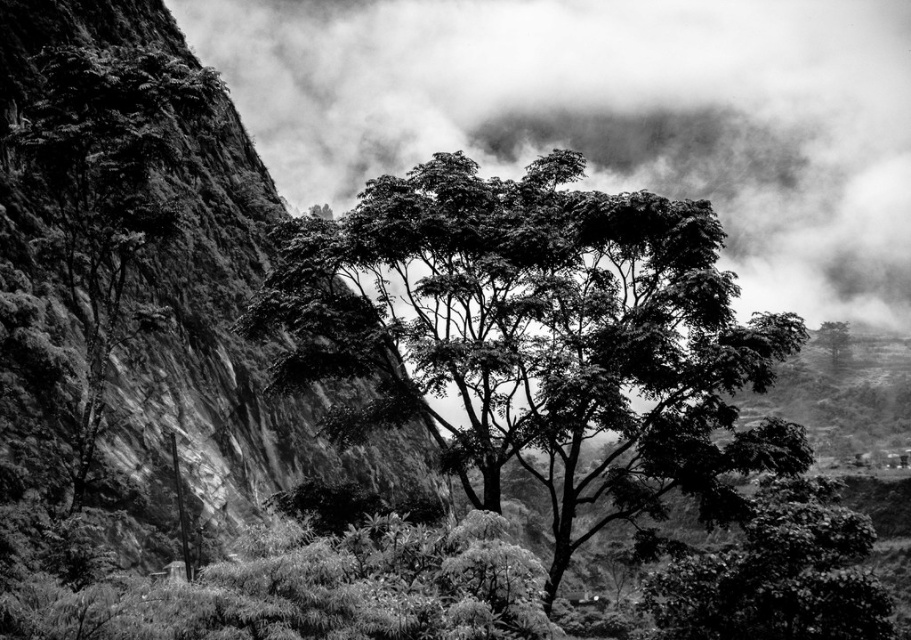
Locate an element on the screen. cloudy sky at upper center is located at coordinates (608, 115).

Consider the image. Is cloudy sky at upper center shorter than dark green leafy tree at left?

In fact, cloudy sky at upper center may be taller than dark green leafy tree at left.

Which is in front, point (275, 52) or point (132, 83)?

Point (132, 83)

Find the location of a particular element. This screenshot has width=911, height=640. cloudy sky at upper center is located at coordinates (608, 115).

Does dark green leafy tree at left have a larger size compared to green leafy tree at upper right?

Yes.

In the scene shown: Does dark green leafy tree at left lie behind green leafy tree at upper right?

That is False.

What do you see at coordinates (107, 195) in the screenshot? The height and width of the screenshot is (640, 911). I see `dark green leafy tree at left` at bounding box center [107, 195].

Locate an element on the screen. dark green leafy tree at left is located at coordinates [107, 195].

Is point (471, 76) farther from viewer compared to point (471, 477)?

Yes, it is behind point (471, 477).

Looking at this image, does cloudy sky at upper center have a lesser width compared to dark green leafy tree at center?

In fact, cloudy sky at upper center might be wider than dark green leafy tree at center.

Does point (692, 81) come farther from viewer compared to point (601, 243)?

That is True.

At what (x,y) coordinates should I click in order to perform the action: click on cloudy sky at upper center. Please return your answer as a coordinate pair (x, y). Looking at the image, I should click on (608, 115).